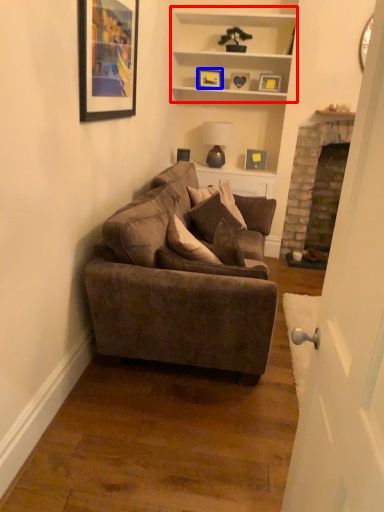
Question: Among these objects, which one is nearest to the camera, cabinet (highlighted by a red box) or picture frame (highlighted by a blue box)?

Choices:
 (A) cabinet
 (B) picture frame

Answer: (A)